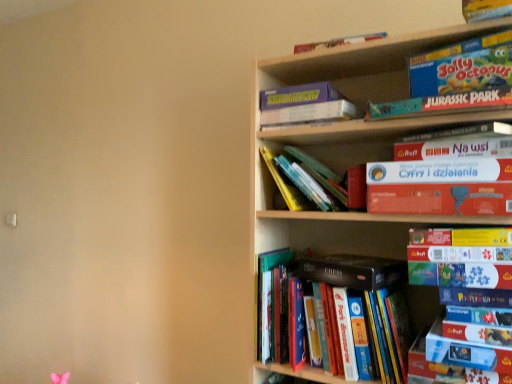
Question: In terms of width, does hardcover chess book at center, which ranks as the 2th paperback book in top-to-bottom order, look wider or thinner when compared to matte cardboard book at lower right, the 2th book positioned from the bottom?

Choices:
 (A) thin
 (B) wide

Answer: (B)

Question: From a real-world perspective, is hardcover chess book at center, which is the first paperback book in bottom-to-top order, above or below matte cardboard book at lower right, acting as the 11th book starting from the top?

Choices:
 (A) above
 (B) below

Answer: (A)

Question: Which object is the closest to the orange matte board game at upper right, which ranks as the first paperback book in top-to-bottom order?

Choices:
 (A) blue cardboard puzzle at lower right, placed as the third book when sorted from bottom to top
 (B) teal cardboard jurassic park book at upper right, which is the 8th book in bottom-to-top order
 (C) hardcover chess book at center, which ranks as the 2th paperback book in top-to-bottom order
 (D) matte cardboard book at lower right, the 2th book positioned from the bottom
 (E) blue cardboard puzzle at upper right, the 4th book in the bottom-to-top sequence

Answer: (E)

Question: Which of these objects is positioned farthest from the hardcover books at center, which ranks as the first book in bottom-to-top order?

Choices:
 (A) matte cardboard book at lower right, acting as the 11th book starting from the top
 (B) blue cardboard puzzle at upper right, the 4th book in the bottom-to-top sequence
 (C) matte board game at upper right, marked as the 2th book in a top-to-bottom arrangement
 (D) teal cardboard jurassic park book at upper right, the fifth book viewed from the top
 (E) hardcover chess book at center, which ranks as the 2th paperback book in top-to-bottom order

Answer: (C)